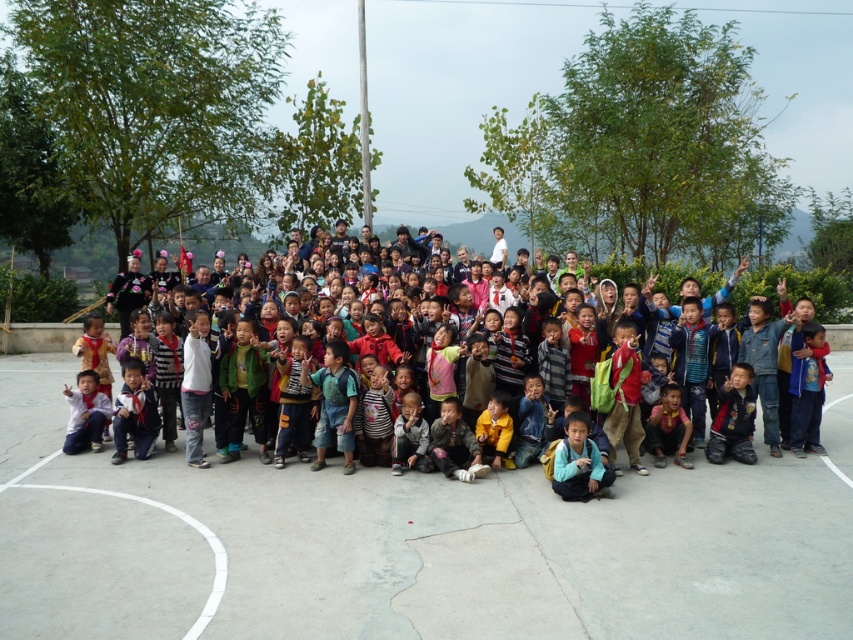
Is gray concrete basketball court at center smaller than multicolored clothing at center?

Yes, gray concrete basketball court at center is smaller than multicolored clothing at center.

Find the location of a particular element. gray concrete basketball court at center is located at coordinates (413, 541).